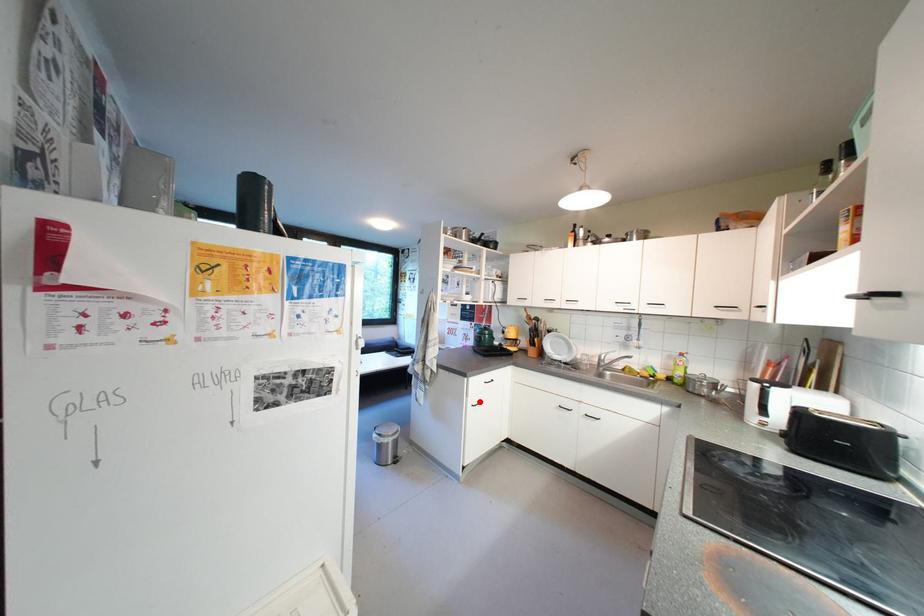
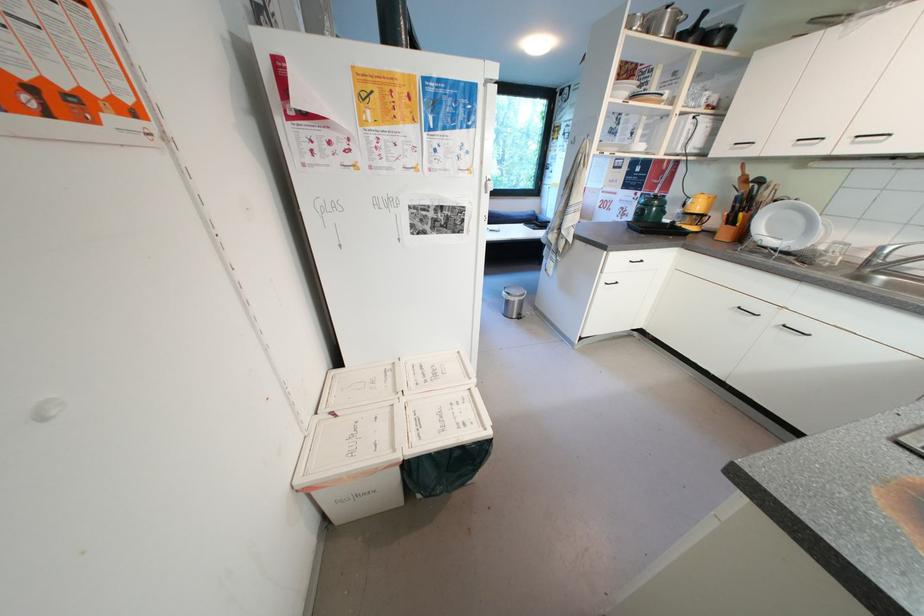
In the second image, find the point that corresponds to the highlighted location in the first image.

(614, 280)